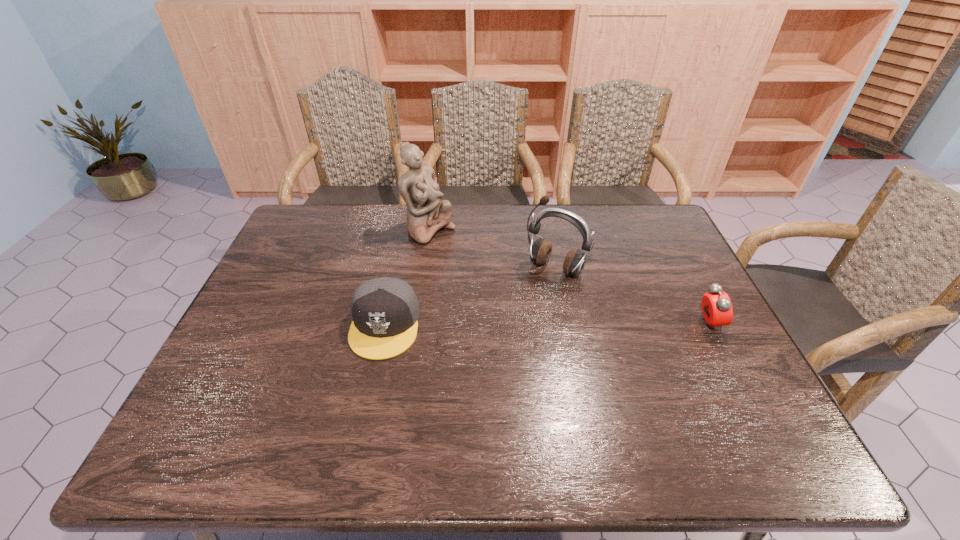
At what (x,y) coordinates should I click in order to perform the action: click on cap. Please return your answer as a coordinate pair (x, y). The height and width of the screenshot is (540, 960). Looking at the image, I should click on (385, 311).

Locate an element on the screen. the rightmost object is located at coordinates (717, 310).

Find the location of a particular element. earphone is located at coordinates (540, 251).

Image resolution: width=960 pixels, height=540 pixels. I want to click on the third shortest object, so click(x=540, y=251).

You are a GUI agent. You are given a task and a screenshot of the screen. Output one action in this format:
    pyautogui.click(x=<x>, y=<y>)
    Task: Click on the figurine
    
    Given the screenshot: What is the action you would take?
    pyautogui.click(x=426, y=213)

Locate an element on the screen. the tallest object is located at coordinates (426, 213).

Where is `vacant area located on the front-facing side of the cap`? Image resolution: width=960 pixels, height=540 pixels. vacant area located on the front-facing side of the cap is located at coordinates (369, 400).

Find the location of a particular element. This screenshot has height=540, width=960. free region located 0.150m on the ear pads of the second farthest object is located at coordinates [520, 314].

In order to click on vacant area located 0.390m on the ear pads of the second farthest object in this screenshot , I will do `click(476, 379)`.

Locate an element on the screen. This screenshot has width=960, height=540. free space located 0.350m on the ear pads of the second farthest object is located at coordinates (484, 367).